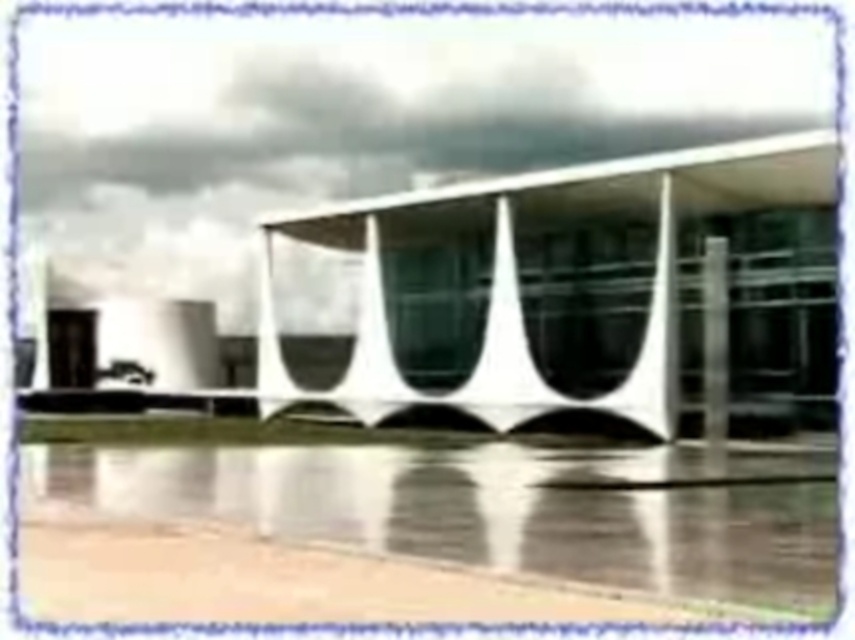
Can you confirm if white glass building at center is positioned to the left of black glass pillar at right?

Indeed, white glass building at center is positioned on the left side of black glass pillar at right.

Which is more to the left, white glass building at center or black glass pillar at right?

white glass building at center is more to the left.

Where is `white glass building at center`? The width and height of the screenshot is (855, 640). white glass building at center is located at coordinates (585, 289).